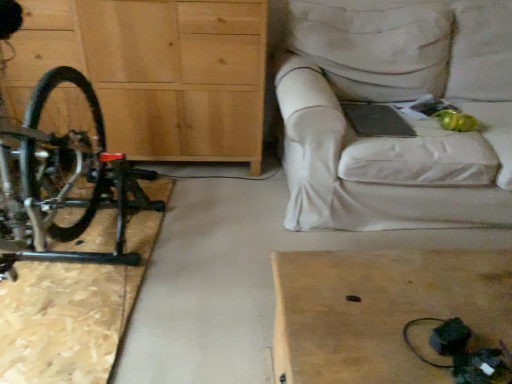
Where is `vacant area that lies between wooden chest of drawers at left and black matte bicycle at left`? This screenshot has height=384, width=512. vacant area that lies between wooden chest of drawers at left and black matte bicycle at left is located at coordinates (196, 238).